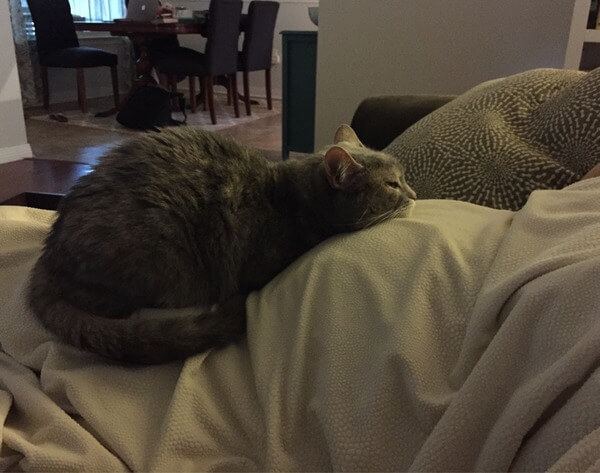
The width and height of the screenshot is (600, 473). What are the coordinates of `chair` in the screenshot? It's located at (228, 43).